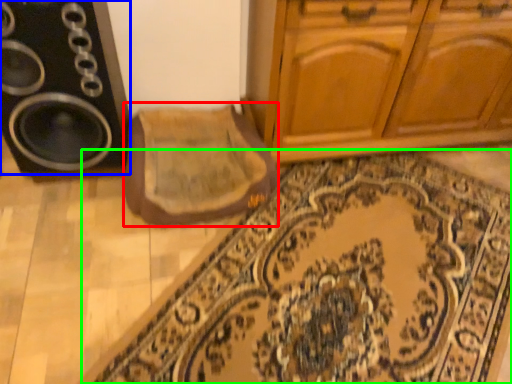
Question: Which object is the farthest from mat (highlighted by a red box)? Choose among these: speaker (highlighted by a blue box) or doormat (highlighted by a green box).

Choices:
 (A) speaker
 (B) doormat

Answer: (B)